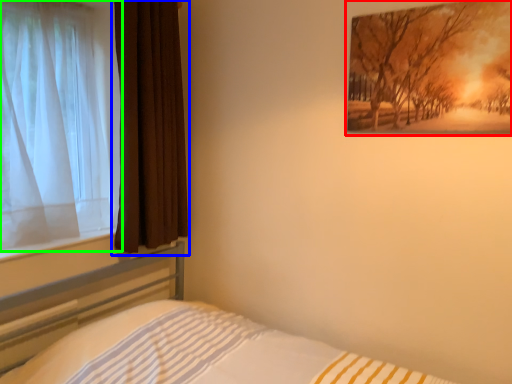
Question: Considering the real-world distances, which object is closest to picture frame (highlighted by a red box)? curtain (highlighted by a blue box) or curtain (highlighted by a green box).

Choices:
 (A) curtain
 (B) curtain

Answer: (A)